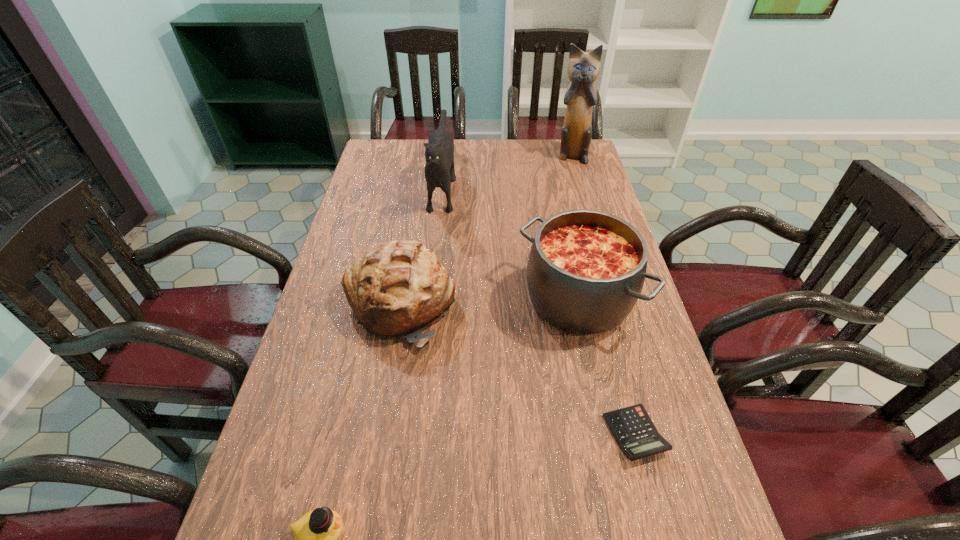
Locate an element on the screen. the taller cat is located at coordinates (583, 69).

Where is `the tallest object`? the tallest object is located at coordinates (583, 69).

Locate an element on the screen. The image size is (960, 540). the second tallest object is located at coordinates click(439, 170).

Where is `the shorter cat`? The width and height of the screenshot is (960, 540). the shorter cat is located at coordinates (439, 170).

Where is `the third tallest object`? The image size is (960, 540). the third tallest object is located at coordinates (586, 269).

At what (x,y) coordinates should I click in order to perform the action: click on the fourth tallest object. Please return your answer as a coordinate pair (x, y). Looking at the image, I should click on (397, 288).

The width and height of the screenshot is (960, 540). In order to click on the second nearest object in this screenshot , I will do point(636,435).

Identify the location of the shortest object. (636, 435).

Where is `vacant region located 0.120m on the face of the taller cat`? The image size is (960, 540). vacant region located 0.120m on the face of the taller cat is located at coordinates (579, 182).

Where is `blank area located 0.160m on the front-facing side of the shorter cat`? This screenshot has height=540, width=960. blank area located 0.160m on the front-facing side of the shorter cat is located at coordinates (435, 255).